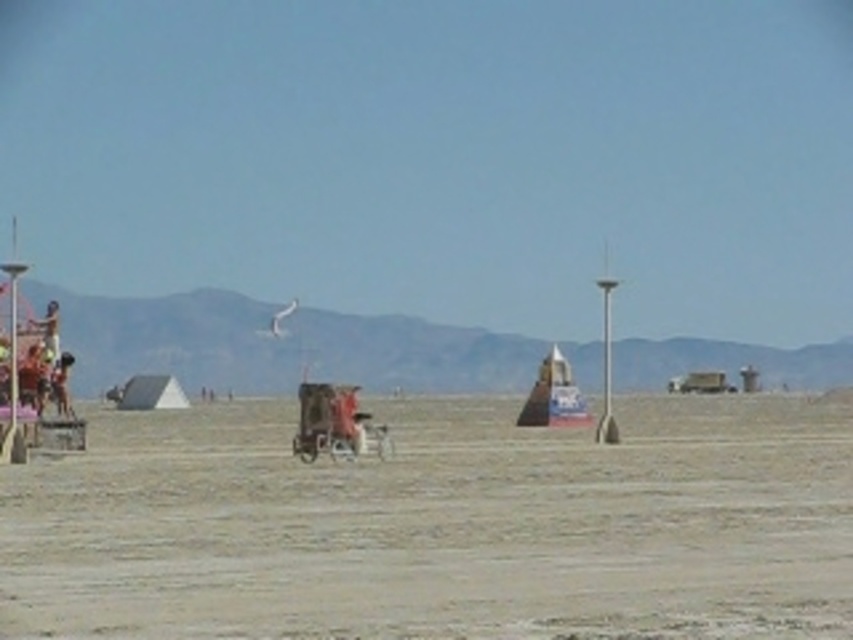
You are standing in the desert and see the gray sand at center and the metallic silver baby carriage at center. Which object takes up more horizontal space from left to right?

The gray sand at center takes up more horizontal space because its width is larger than that of the metallic silver baby carriage at center.

You are a photographer planning to take a photo of the gray sand at center and the metallic silver baby carriage at center. You want to ensure both are in focus. If your camera has a depth of field that can cover 40 feet, will you be able to capture both objects clearly in the same shot?

The distance between the gray sand at center and the metallic silver baby carriage at center is 45.62 feet. Since the camera can only cover 40 feet, it will not be sufficient to keep both objects in focus simultaneously.

You are standing in the desert and see the gray sand at center and the metallic silver baby carriage at center. Which object is positioned to the right of the other?

The gray sand at center is to the right of the metallic silver baby carriage at center.